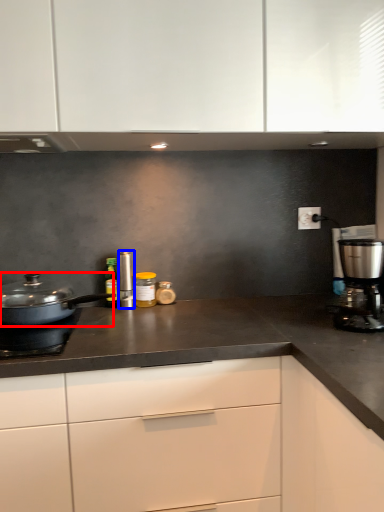
Question: Which object appears closest to the camera in this image, home appliance (highlighted by a red box) or kitchen appliance (highlighted by a blue box)?

Choices:
 (A) home appliance
 (B) kitchen appliance

Answer: (A)